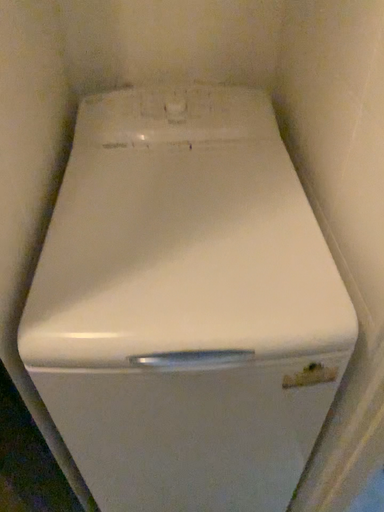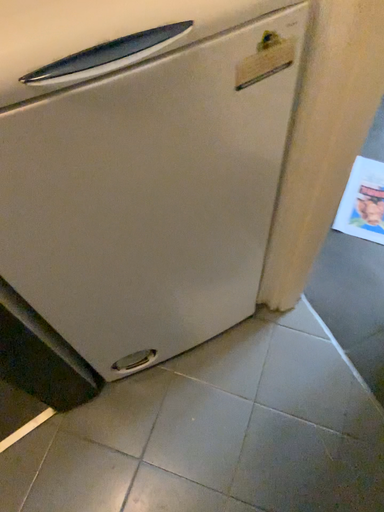
Question: Which way did the camera rotate in the video?

Choices:
 (A) rotated left
 (B) rotated right

Answer: (B)